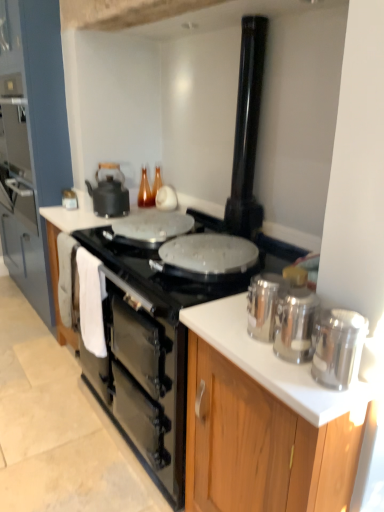
Locate an element on the screen. Image resolution: width=384 pixels, height=512 pixels. vacant space in front of matte black kettle at upper left, the first kitchen appliance in the left-to-right sequence is located at coordinates (71, 216).